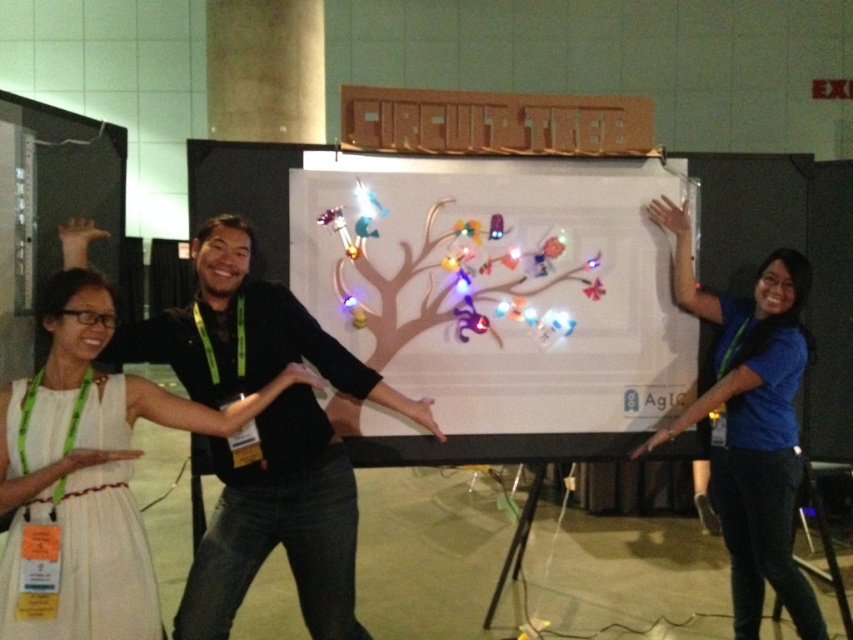
Between white paper at center and blue shirt at upper right, which one appears on the right side from the viewer's perspective?

blue shirt at upper right

Does white paper at center have a greater height compared to blue shirt at upper right?

Incorrect, white paper at center's height is not larger of blue shirt at upper right's.

Does point (328, 330) come farther from viewer compared to point (720, 490)?

No, it is not.

Identify the location of white paper at center. Image resolution: width=853 pixels, height=640 pixels. (495, 301).

Is point (334, 300) positioned before point (90, 538)?

No.

Between white paper at center and white fabric dress at center, which one is positioned lower?

white fabric dress at center is below.

Is point (354, 432) in front of point (12, 458)?

That is False.

Locate an element on the screen. This screenshot has width=853, height=640. white paper at center is located at coordinates (495, 301).

Is white fabric dress at center wider than blue shirt at upper right?

Yes, white fabric dress at center is wider than blue shirt at upper right.

Who is higher up, white fabric dress at center or blue shirt at upper right?

white fabric dress at center is above.

Identify the location of white fabric dress at center. (91, 470).